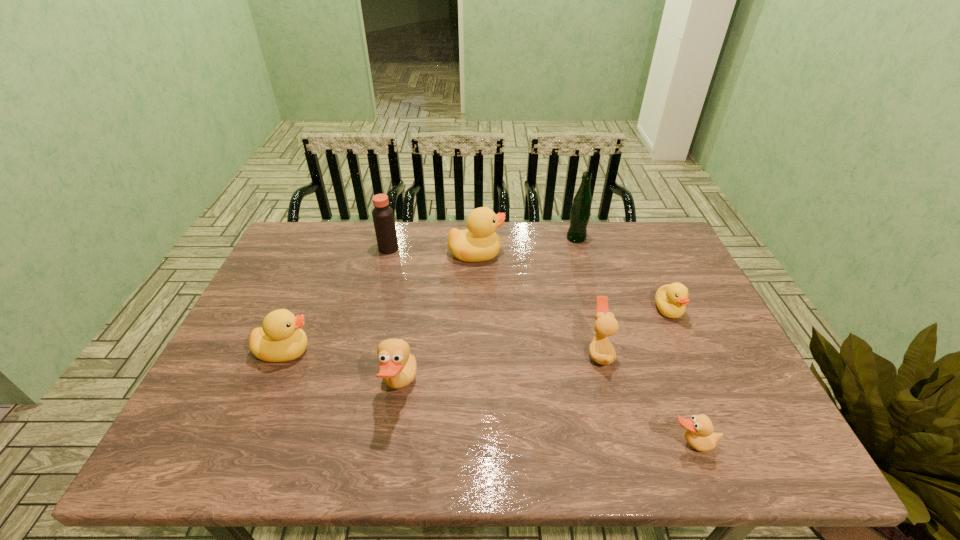
Locate an element on the screen. The height and width of the screenshot is (540, 960). free region located 0.190m at the beak of the nearest yellow duck is located at coordinates (388, 351).

Find the location of a particular element. vacant area situated on the beak of the second smallest tan duck is located at coordinates 528,352.

This screenshot has width=960, height=540. Find the location of `vacant space located on the beak of the second smallest tan duck`. vacant space located on the beak of the second smallest tan duck is located at coordinates (465, 352).

Where is `blank area located 0.220m on the beak of the second smallest tan duck`? This screenshot has width=960, height=540. blank area located 0.220m on the beak of the second smallest tan duck is located at coordinates (500, 352).

Where is `vacant region located at the beak of the second farthest duck`? vacant region located at the beak of the second farthest duck is located at coordinates (690, 359).

Locate an element on the screen. This screenshot has width=960, height=540. beer bottle that is at the far edge is located at coordinates (580, 212).

At what (x,y) coordinates should I click in order to perform the action: click on vinegar present at the far edge. Please return your answer as a coordinate pair (x, y). The height and width of the screenshot is (540, 960). Looking at the image, I should click on (383, 217).

The height and width of the screenshot is (540, 960). Find the location of `duck located at the far edge`. duck located at the far edge is located at coordinates (479, 242).

Locate an element on the screen. This screenshot has width=960, height=540. object that is at the near edge is located at coordinates (699, 433).

Locate an element on the screen. This screenshot has height=540, width=960. object that is at the left edge is located at coordinates (280, 339).